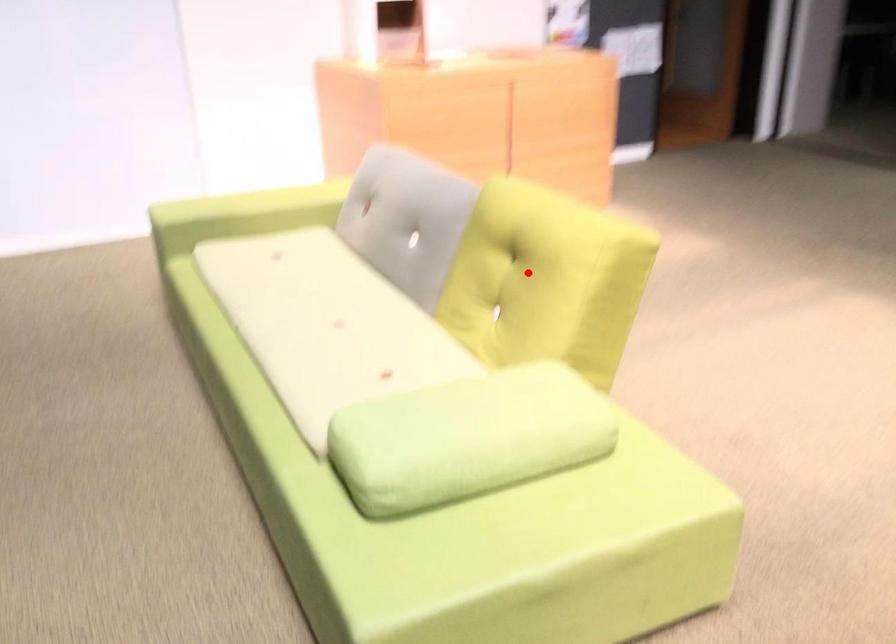
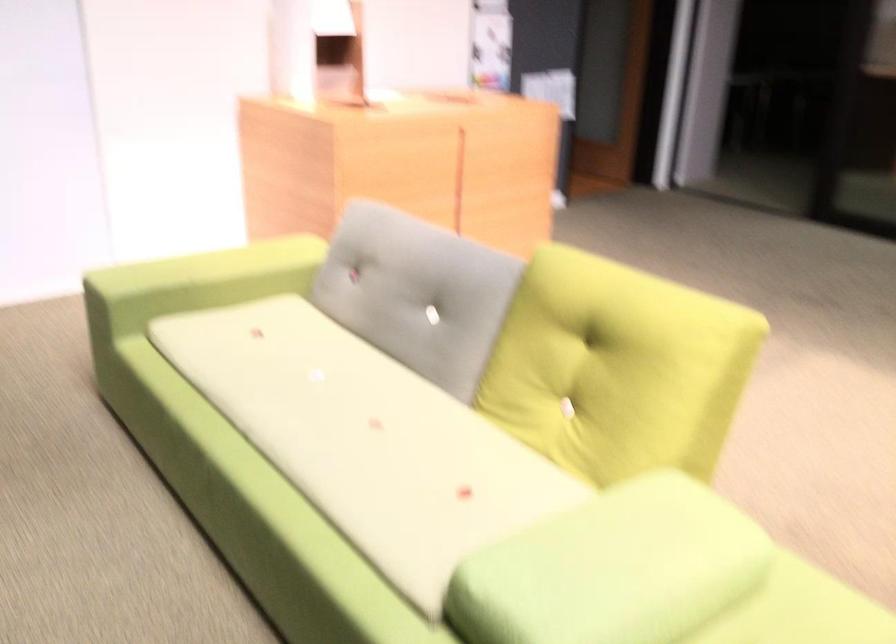
Question: I am providing you with two images of the same scene from different viewpoints. Image1 has a red point marked. In image2, the corresponding 3D location appears at what relative position? Reply with the corresponding letter.

Choices:
 (A) Closer
 (B) Farther

Answer: (A)